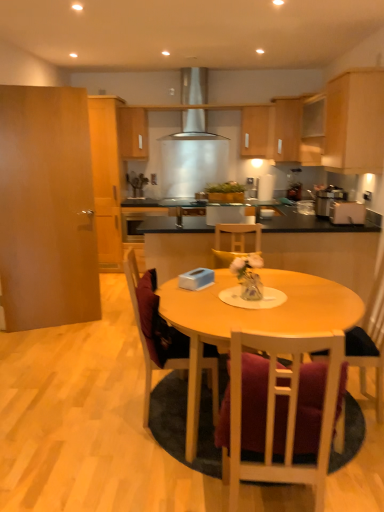
Where is `vacant space that is to the left of wooden chair at center, which is the 1th chair in left-to-right order`? vacant space that is to the left of wooden chair at center, which is the 1th chair in left-to-right order is located at coordinates (103, 419).